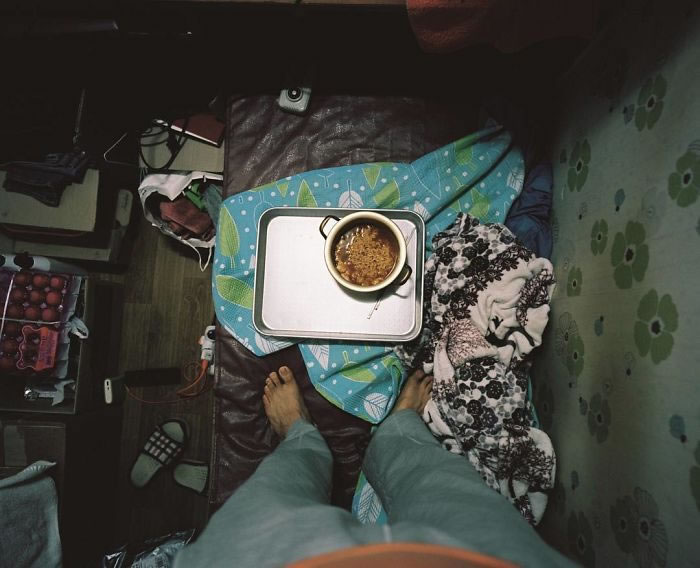
The image size is (700, 568). In order to click on blankets in this screenshot , I will do `click(495, 275)`, `click(540, 212)`, `click(452, 178)`, `click(10, 502)`.